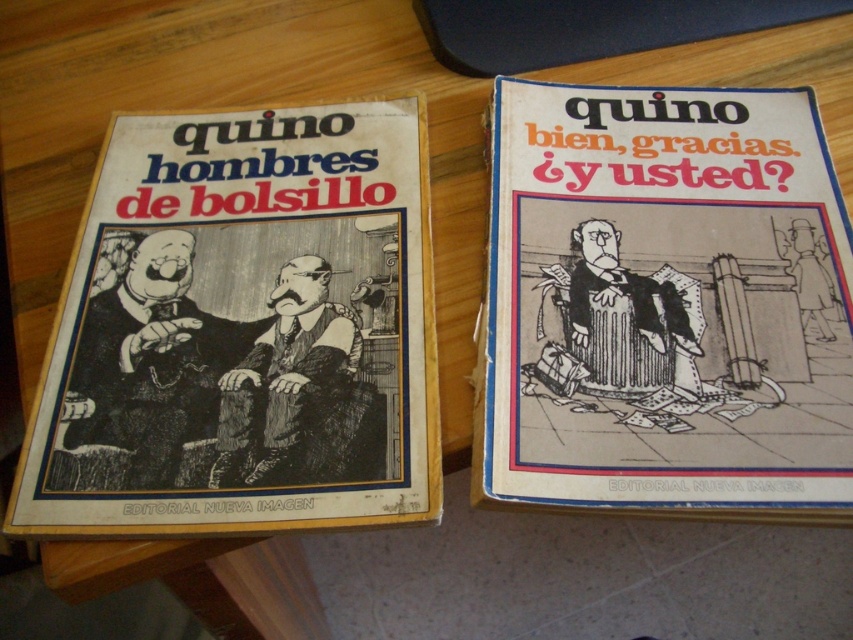
Is point (125, 220) behind point (703, 328)?

Yes, it is.

Which is more to the left, black paper book at left or black line art man at center?

From the viewer's perspective, black paper book at left appears more on the left side.

Where is `black paper book at left`? The height and width of the screenshot is (640, 853). black paper book at left is located at coordinates (242, 332).

Image resolution: width=853 pixels, height=640 pixels. What are the coordinates of `black paper book at left` in the screenshot? It's located at (242, 332).

Who is lower down, black paper book at center or black ink drawing of man at center?

Positioned lower is black ink drawing of man at center.

Is point (683, 189) more distant than point (291, 368)?

Yes.

Is point (514, 291) positioned before point (352, 326)?

No, (514, 291) is further to viewer.

Where is `black paper book at center`? This screenshot has height=640, width=853. black paper book at center is located at coordinates (664, 305).

Is point (550, 401) closer to viewer compared to point (666, 372)?

Yes, point (550, 401) is in front of point (666, 372).

Does point (827, 436) come farther from viewer compared to point (624, 314)?

No, it is in front of (624, 314).

This screenshot has height=640, width=853. Find the location of `black paper book at center`. black paper book at center is located at coordinates (664, 305).